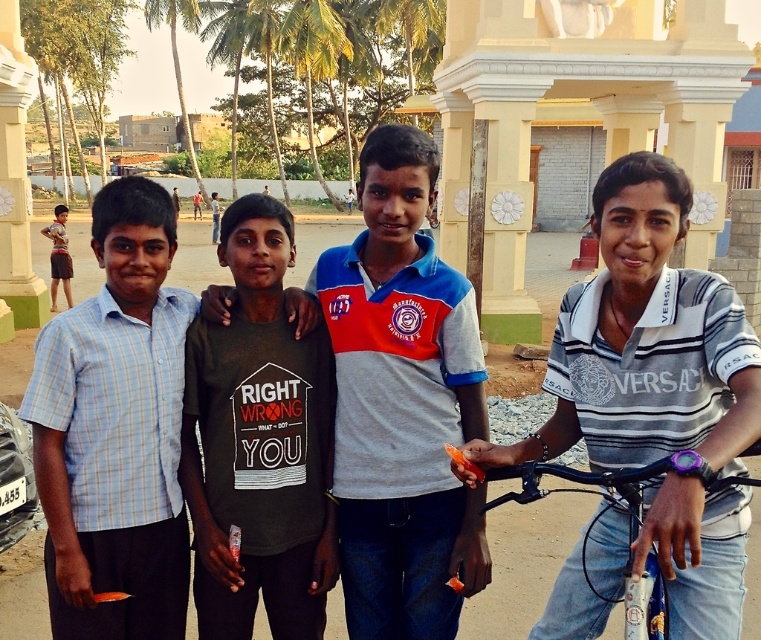
You are a photographer trying to capture a photo of the black matte shirt at center and the metallic blue bicycle at lower right. Based on their positions, which object is closer to the left edge of the photo?

The black matte shirt at center is positioned on the left side of the metallic blue bicycle at lower right, so the black matte shirt at center is closer to the left edge of the photo.

You are a photographer trying to adjust the focus of your camera. You have two points to focus on in the image. The first point is at coordinate point (600,339) and the second is at point (295,545). Which point should you focus on if you want to capture the person closest to the camera?

Point (600,339) is in front of point (295,545), so you should focus on point (600,339) to capture the person closest to the camera.

Consider the image. You are a photographer trying to capture a photo of the gray cotton shirt at center and the metallic blue bicycle at lower right. Which object is taller?

The gray cotton shirt at center is much taller as metallic blue bicycle at lower right.